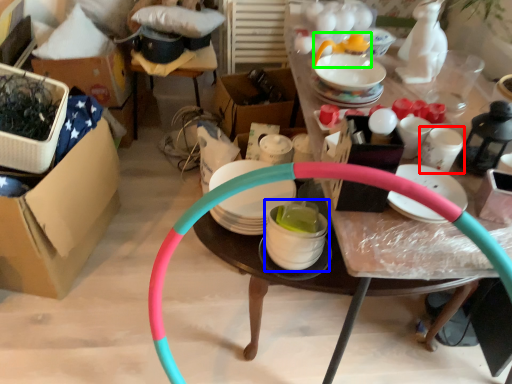
Question: Based on their relative distances, which object is nearer to tableware (highlighted by a red box)? Choose from tableware (highlighted by a blue box) and tableware (highlighted by a green box).

Choices:
 (A) tableware
 (B) tableware

Answer: (A)